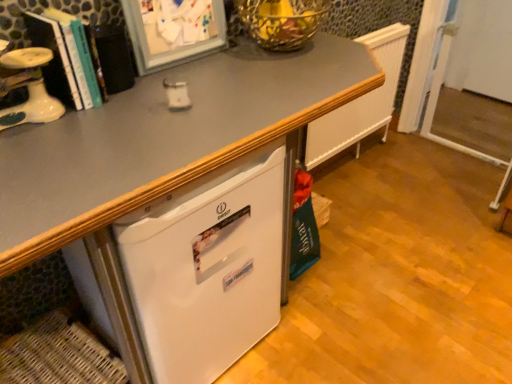
Question: Does woven brown basket at lower left have a smaller size compared to white plastic screen door at right?

Choices:
 (A) yes
 (B) no

Answer: (B)

Question: Is woven brown basket at lower left to the right of white plastic screen door at right from the viewer's perspective?

Choices:
 (A) yes
 (B) no

Answer: (B)

Question: Would you say white plastic screen door at right is part of woven brown basket at lower left's contents?

Choices:
 (A) yes
 (B) no

Answer: (B)

Question: Does woven brown basket at lower left have a larger size compared to white plastic screen door at right?

Choices:
 (A) no
 (B) yes

Answer: (B)

Question: From the image's perspective, is woven brown basket at lower left above white plastic screen door at right?

Choices:
 (A) yes
 (B) no

Answer: (B)

Question: From the image's perspective, relative to white plastic screen door at right, is hardcover book at left above or below?

Choices:
 (A) above
 (B) below

Answer: (B)

Question: Based on their positions, is hardcover book at left located to the left or right of white plastic screen door at right?

Choices:
 (A) right
 (B) left

Answer: (B)

Question: In terms of size, does hardcover book at left appear bigger or smaller than white plastic screen door at right?

Choices:
 (A) small
 (B) big

Answer: (A)

Question: Considering the positions of hardcover book at left and white plastic screen door at right in the image, is hardcover book at left taller or shorter than white plastic screen door at right?

Choices:
 (A) tall
 (B) short

Answer: (B)

Question: In the image, is hardcover book at left on the left side or the right side of woven brown basket at lower left?

Choices:
 (A) right
 (B) left

Answer: (A)

Question: Considering the positions of hardcover book at left and woven brown basket at lower left in the image, is hardcover book at left taller or shorter than woven brown basket at lower left?

Choices:
 (A) tall
 (B) short

Answer: (A)

Question: Is hardcover book at left in front of or behind woven brown basket at lower left in the image?

Choices:
 (A) behind
 (B) front

Answer: (B)

Question: Is hardcover book at left inside the boundaries of woven brown basket at lower left, or outside?

Choices:
 (A) outside
 (B) inside

Answer: (A)

Question: Would you say white matte refrigerator at lower left is inside or outside hardcover book at left?

Choices:
 (A) outside
 (B) inside

Answer: (A)

Question: Does point (248, 258) appear closer or farther from the camera than point (118, 51)?

Choices:
 (A) closer
 (B) farther

Answer: (B)